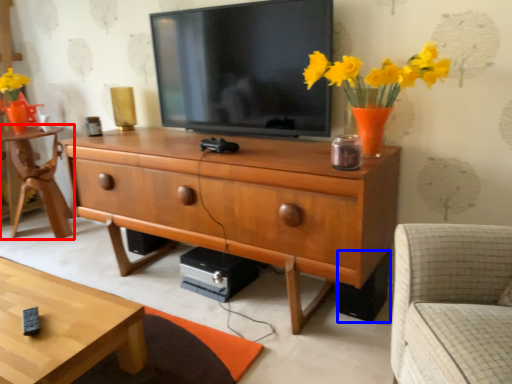
Question: Which object is further to the camera taking this photo, desk (highlighted by a red box) or speaker (highlighted by a blue box)?

Choices:
 (A) desk
 (B) speaker

Answer: (A)